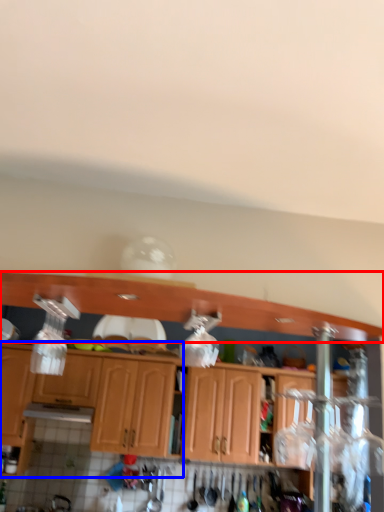
Question: Which of the following is the closest to the observer, cabinetry (highlighted by a red box) or cabinetry (highlighted by a blue box)?

Choices:
 (A) cabinetry
 (B) cabinetry

Answer: (A)